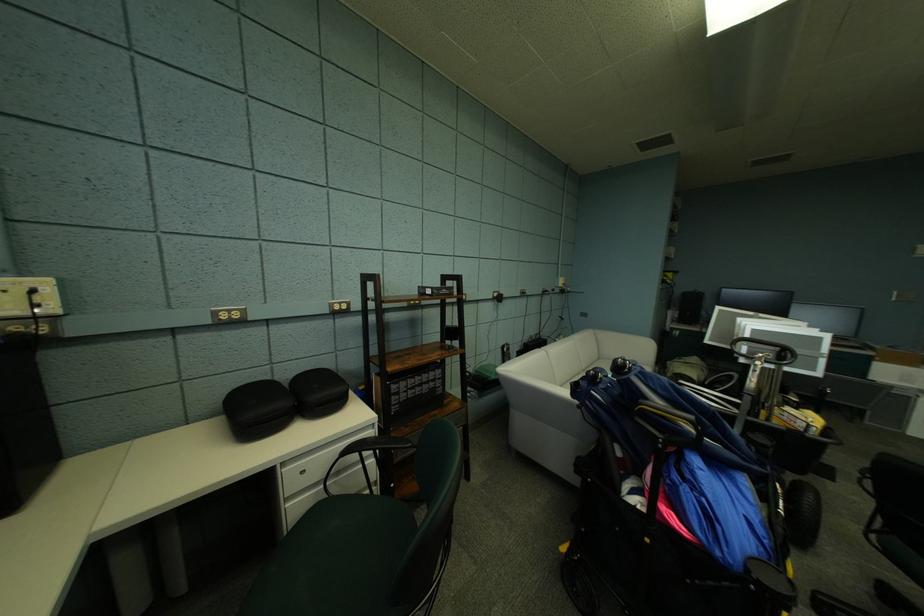
Where would you resting arm the black chair armrest? Please return your answer as a coordinate pair (x, y).

(383, 447)